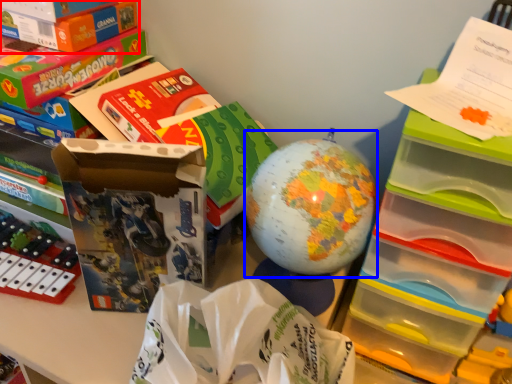
Question: Among these objects, which one is farthest to the camera, box (highlighted by a red box) or toy (highlighted by a blue box)?

Choices:
 (A) box
 (B) toy

Answer: (A)